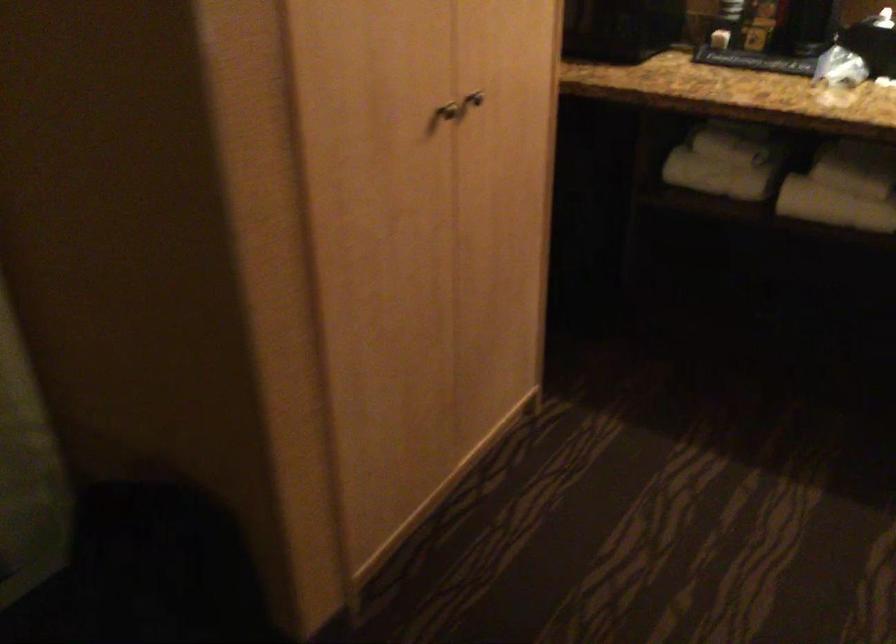
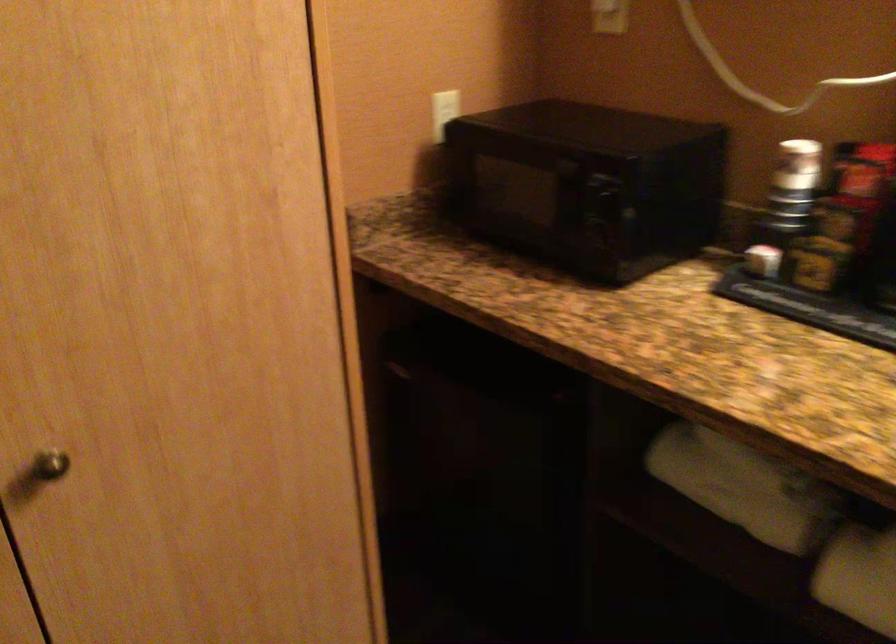
The point at (452, 100) is marked in the first image. Where is the corresponding point in the second image?

(49, 465)